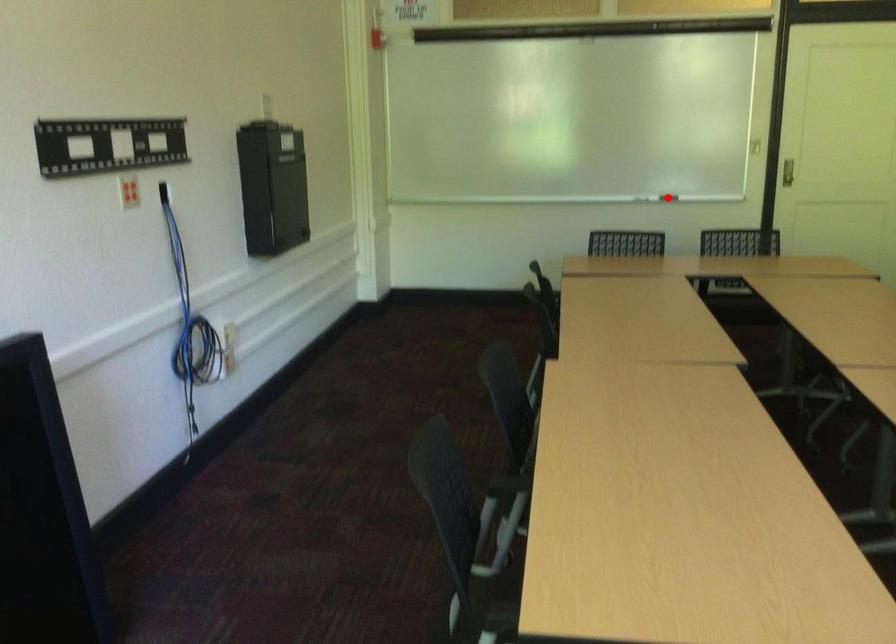
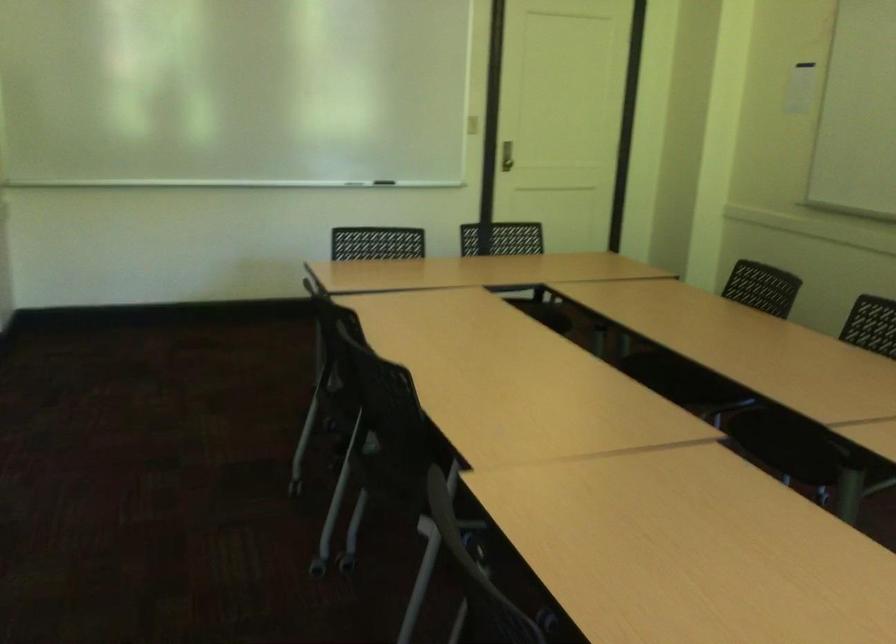
Question: I am providing you with two images of the same scene from different viewpoints. A red point is marked on the first image. Is the red point's position out of view in image 2?

Choices:
 (A) Yes
 (B) No

Answer: (A)